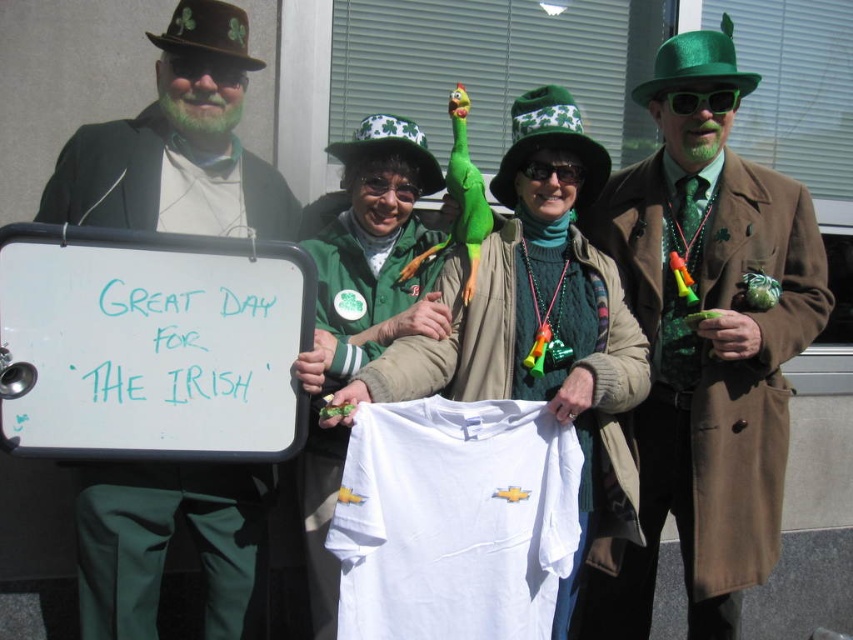
Looking at the festive group, where is the green felt hat at upper right in relation to the matte green suit at left?

The green felt hat at upper right is located to the right of the matte green suit at left.

You are a photographer at the St. Patrick Day parade. You need to take a group photo of the matte green suit at left and the green fabric shirt at center. Which person should stand in the front to ensure both are visible?

The matte green suit at left should stand in the front because it has a lesser height compared to the green fabric shirt at center, ensuring both are visible.